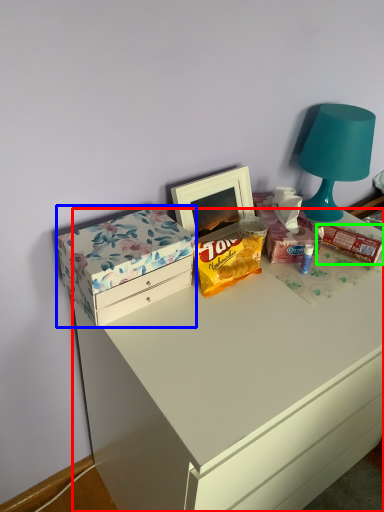
Question: Based on their relative distances, which object is farther from desk (highlighted by a red box)? Choose from box (highlighted by a blue box) and snack (highlighted by a green box).

Choices:
 (A) box
 (B) snack

Answer: (B)